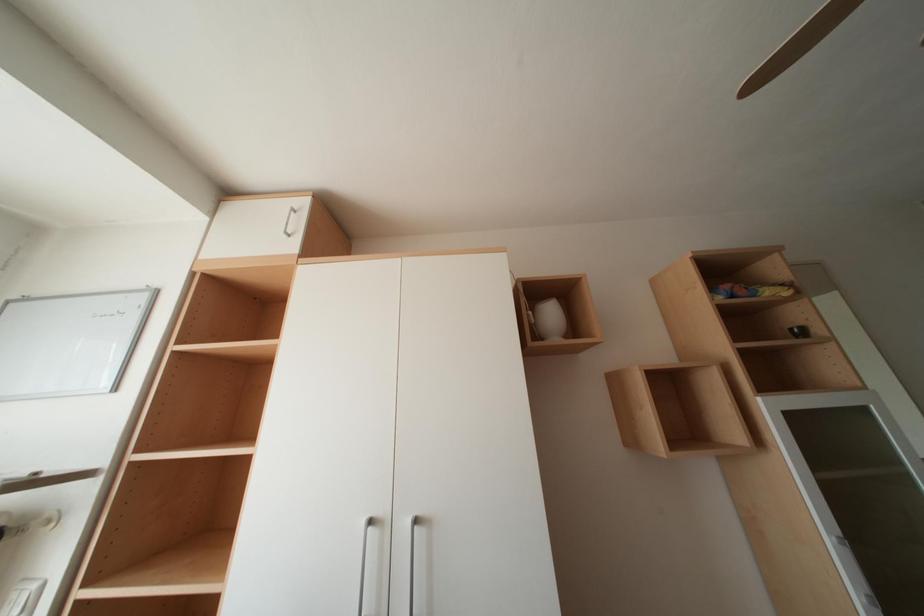
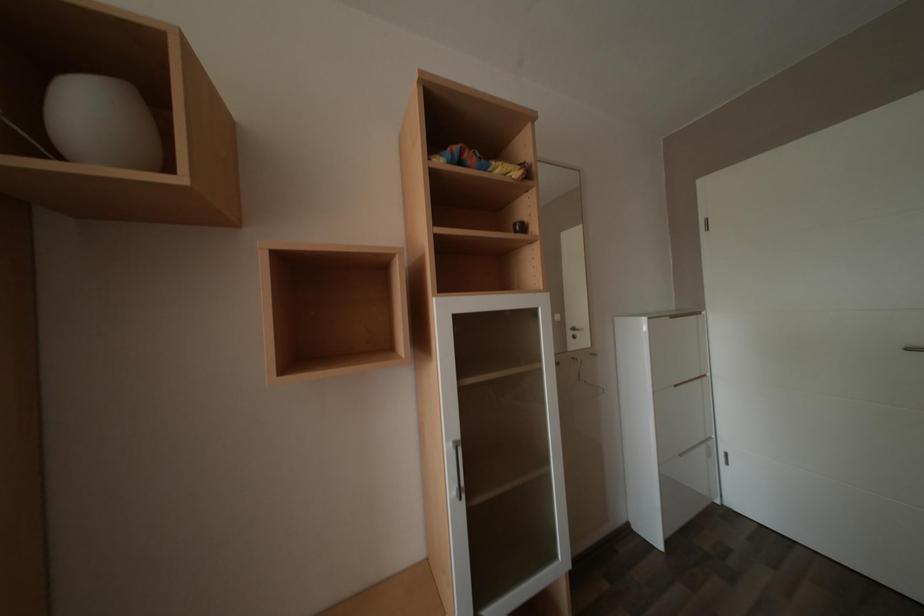
The first image is from the beginning of the video and the second image is from the end. How did the camera likely rotate when shooting the video?

The camera rotated toward right-down.